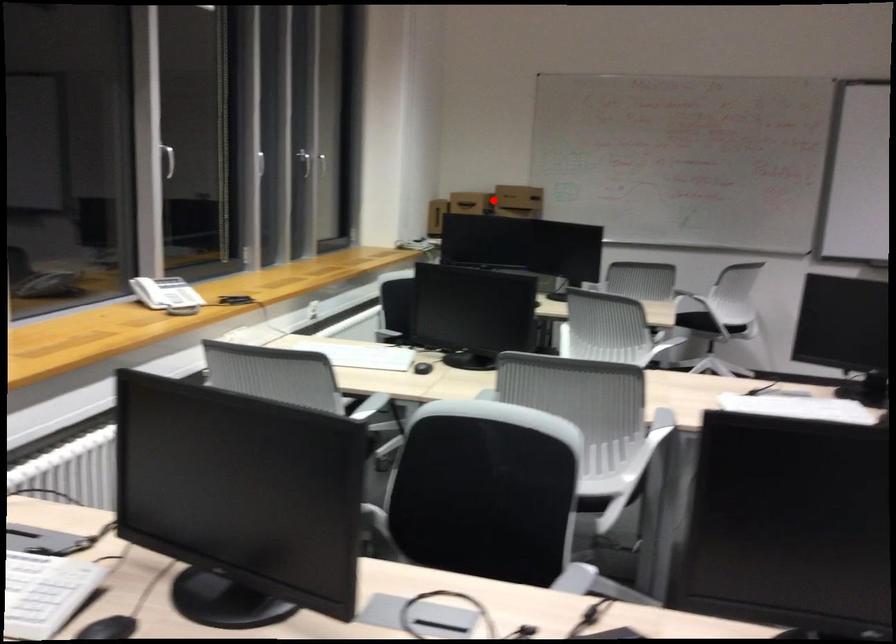
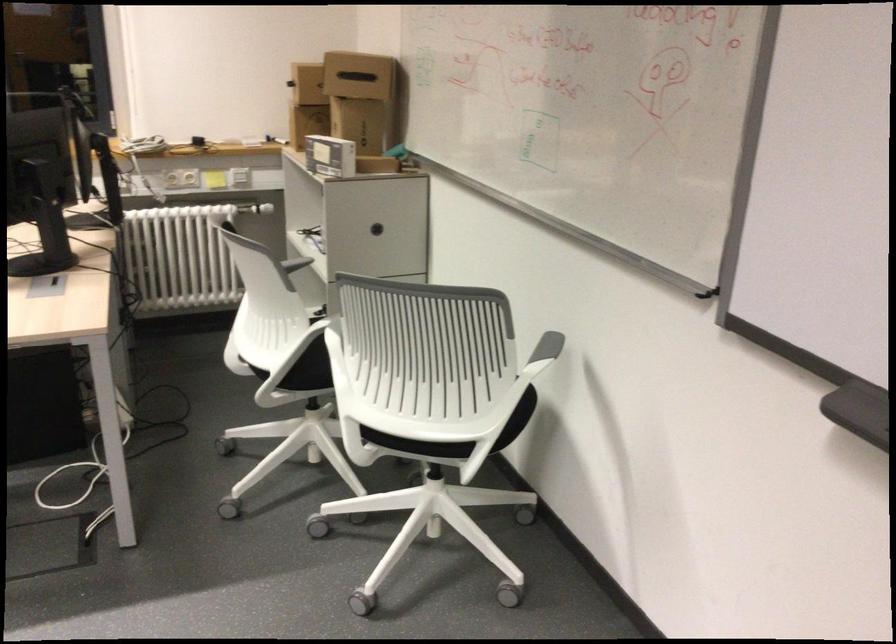
Question: I am providing you with two images of the same scene from different viewpoints. Given a red point in image1, look at the same physical point in image2. Is it:

Choices:
 (A) Closer to the viewpoint
 (B) Farther from the viewpoint

Answer: (A)